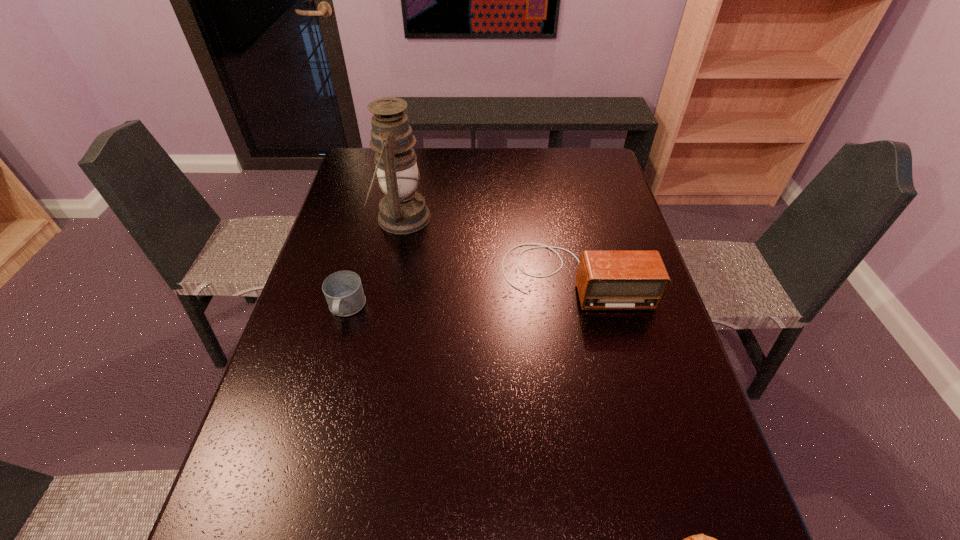
In order to click on empty location between the oil lamp and the radio receiver in this screenshot , I will do `click(488, 247)`.

Image resolution: width=960 pixels, height=540 pixels. Find the location of `object that can be found as the closest to the third shortest object`. object that can be found as the closest to the third shortest object is located at coordinates (403, 210).

Locate an element on the screen. The image size is (960, 540). the second closest object to the tallest object is located at coordinates (606, 280).